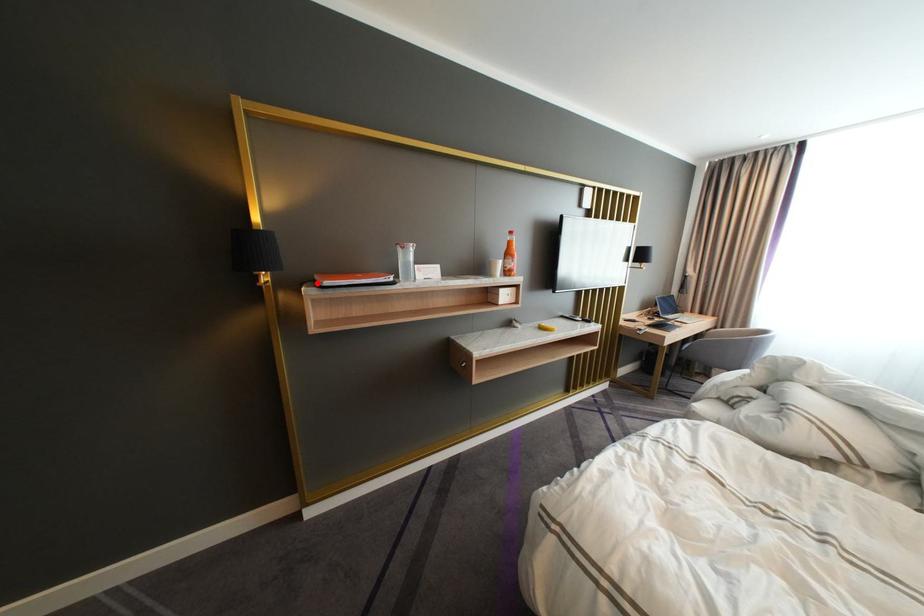
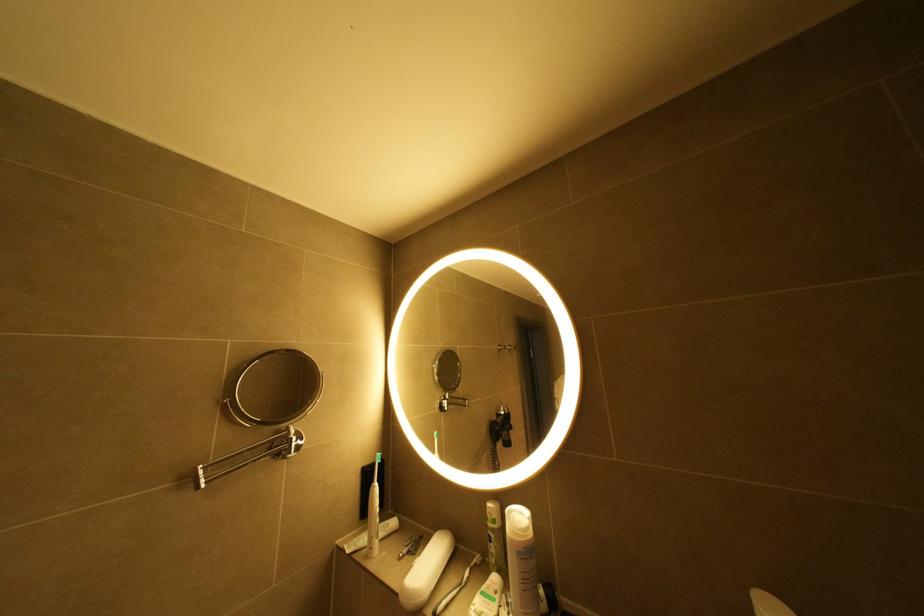
Question: I am providing you with two images of the same scene from different viewpoints. A red point is marked on the first image. At the location where the point appears in image 1, is it still visible in image 2?

Choices:
 (A) Yes
 (B) No

Answer: (B)